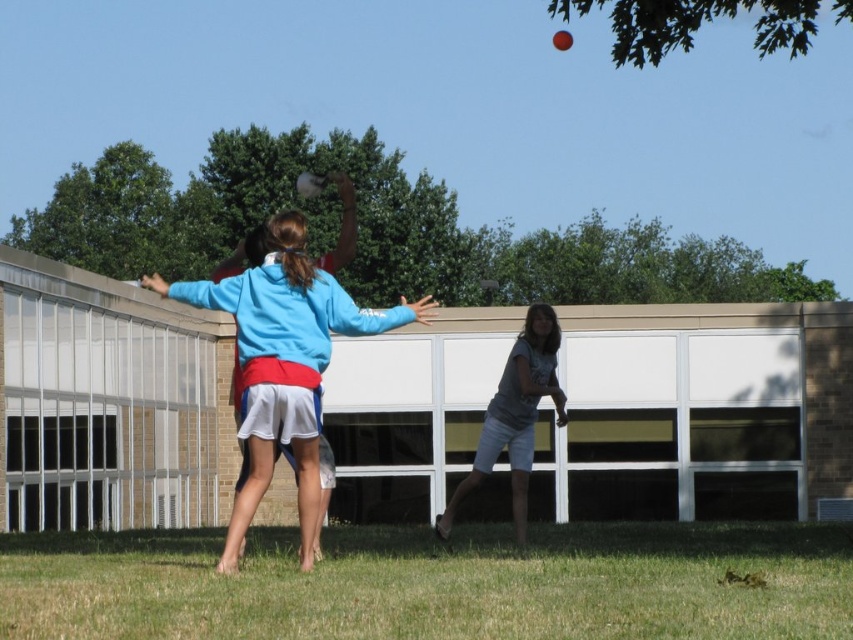
You are standing in the outdoor area and want to determine which object takes up more space between the blue fabric jacket at center and the gray cotton shorts at center. Which one is larger in size?

The blue fabric jacket at center occupies less space than gray cotton shorts at center, so the gray cotton shorts at center is larger in size.

You are a photographer trying to capture the perfect shot of the blue fabric jacket at center and the gray cotton shorts at center. If you want to ensure both are fully visible in the frame without cropping, which object should you adjust your focus on to account for their size difference?

The blue fabric jacket at center might be wider than gray cotton shorts at center, so you should focus on the blue fabric jacket at center to ensure it fits within the frame.

You are standing in the grassy area and want to know which object is shorter between the blue fabric jacket at center and the gray cotton shorts at center. Can you tell me?

The blue fabric jacket at center has a lesser height compared to the gray cotton shorts at center, so the blue fabric jacket at center is shorter.